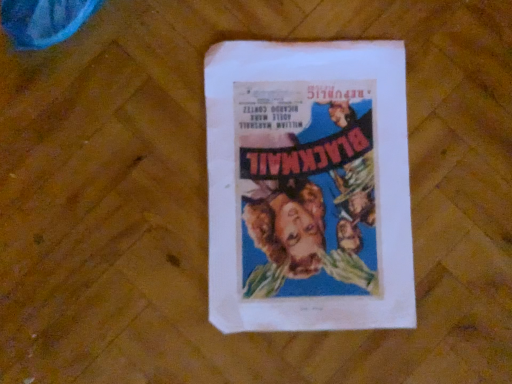
You are a GUI agent. You are given a task and a screenshot of the screen. Output one action in this format:
    pyautogui.click(x=<x>, y=<y>)
    Task: Click on the empty space that is ontop of matte paper poster at center
    
    Given the screenshot: What is the action you would take?
    pyautogui.click(x=311, y=184)